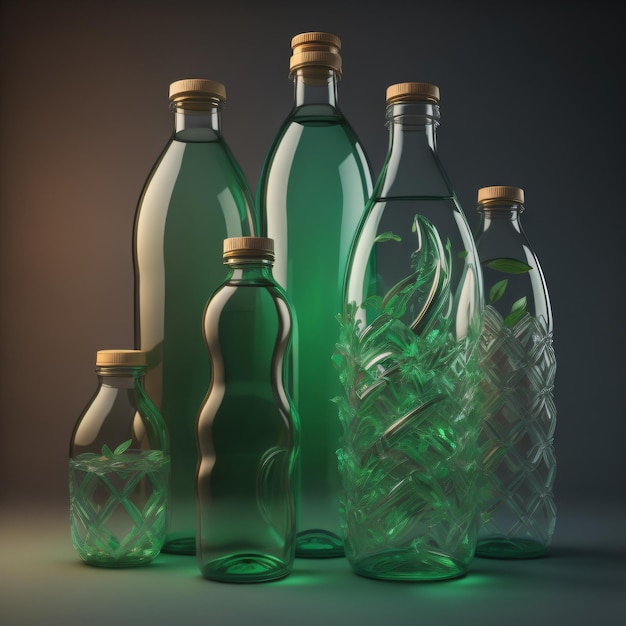
Where is `bottles`? This screenshot has width=626, height=626. bottles is located at coordinates (91, 454), (279, 423), (195, 274), (316, 260), (521, 284), (418, 361).